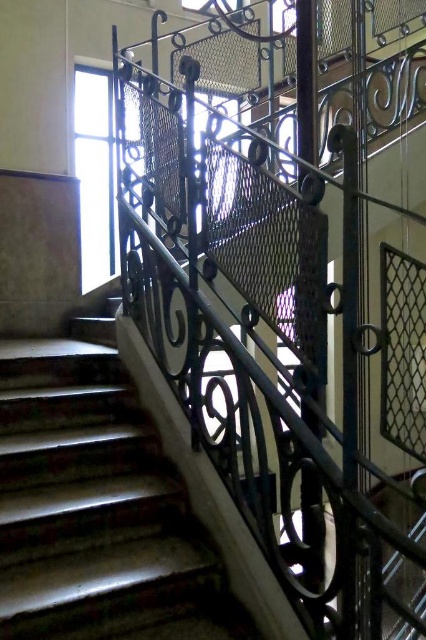
Question: Is black wrought iron at upper center wider than shiny brown stairs at center?

Choices:
 (A) yes
 (B) no

Answer: (A)

Question: Which point is closer to the camera taking this photo?

Choices:
 (A) (340, 472)
 (B) (115, 637)

Answer: (A)

Question: Can you confirm if black wrought iron at upper center is bigger than shiny brown stairs at center?

Choices:
 (A) yes
 (B) no

Answer: (A)

Question: Which object appears closest to the camera in this image?

Choices:
 (A) shiny brown stairs at center
 (B) black wrought iron at upper center

Answer: (B)

Question: Can you confirm if black wrought iron at upper center is bigger than shiny brown stairs at center?

Choices:
 (A) yes
 (B) no

Answer: (A)